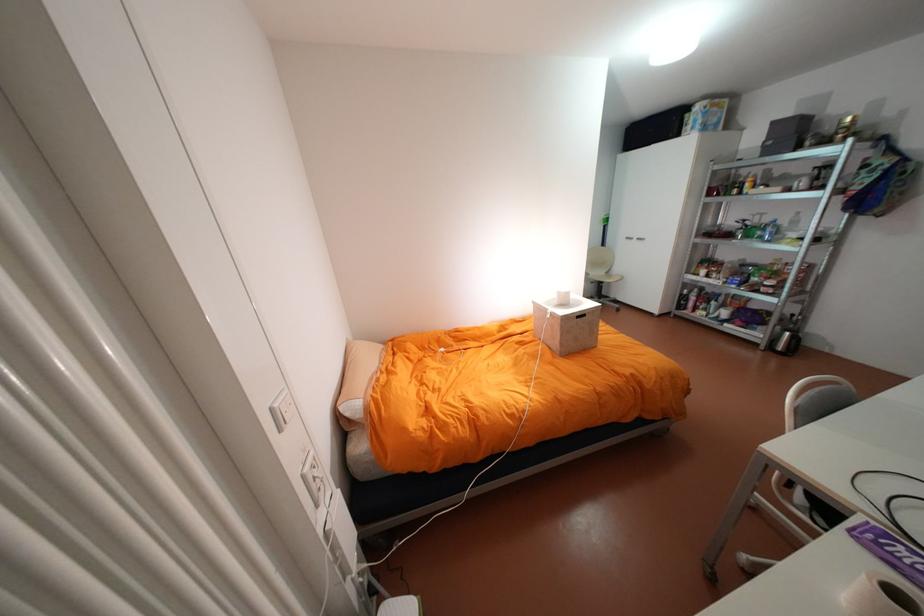
The image size is (924, 616). What do you see at coordinates (795, 345) in the screenshot?
I see `the electric kettle handle` at bounding box center [795, 345].